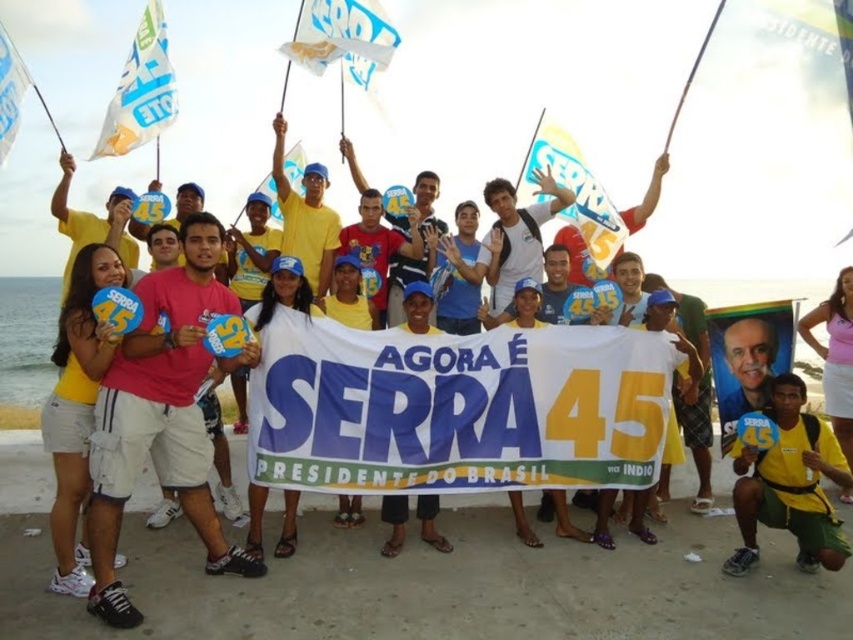
Question: Is yellow fabric shirt at center to the right of white paper flag at upper left from the viewer's perspective?

Choices:
 (A) yes
 (B) no

Answer: (A)

Question: Which of the following is the farthest from the observer?

Choices:
 (A) white paper flag at upper left
 (B) pink fabric shirt at center
 (C) white fabric flag at upper left

Answer: (A)

Question: Is pink fabric shirt at center to the right of white paper flag at upper left from the viewer's perspective?

Choices:
 (A) no
 (B) yes

Answer: (B)

Question: Which of the following is the closest to the observer?

Choices:
 (A) white fabric flag at upper left
 (B) white paper flag at upper center

Answer: (A)

Question: Which point is closer to the camera taking this photo?

Choices:
 (A) (99, 136)
 (B) (567, 168)

Answer: (A)

Question: Is yellow fabric shirt at center positioned before yellow fabric flag at center?

Choices:
 (A) yes
 (B) no

Answer: (A)